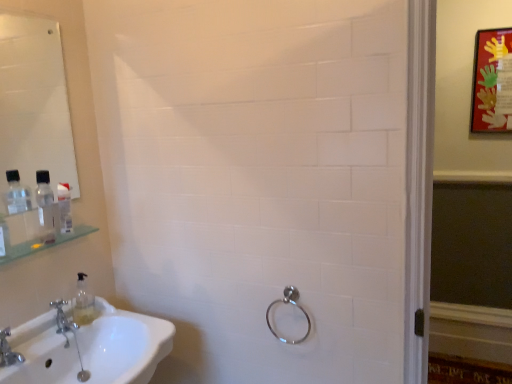
At what (x,y) coordinates should I click in order to perform the action: click on white glossy mirror at upper left. Please return your answer as a coordinate pair (x, y). The width and height of the screenshot is (512, 384). Looking at the image, I should click on (34, 105).

Where is `white glossy sink at lower left`? The height and width of the screenshot is (384, 512). white glossy sink at lower left is located at coordinates (123, 345).

Image resolution: width=512 pixels, height=384 pixels. I want to click on polished chrome towel ring at lower center, so click(292, 304).

Is matte red picture frame at upper right oriented away from clear plastic bottle at left?

matte red picture frame at upper right does not have its back to clear plastic bottle at left.

Considering the positions of objects matte red picture frame at upper right and clear plastic bottle at left in the image provided, who is more to the left, matte red picture frame at upper right or clear plastic bottle at left?

clear plastic bottle at left is more to the left.

Is clear plastic bottle at left a part of matte red picture frame at upper right?

Definitely not — clear plastic bottle at left is not inside matte red picture frame at upper right.

Between matte red picture frame at upper right and clear plastic bottle at left, which one has more height?

matte red picture frame at upper right is taller.

Is polished chrome towel ring at lower center looking in the opposite direction of matte red picture frame at upper right?

No, polished chrome towel ring at lower center's orientation is not away from matte red picture frame at upper right.

Is polished chrome towel ring at lower center located outside matte red picture frame at upper right?

polished chrome towel ring at lower center lies outside matte red picture frame at upper right's area.

From the image's perspective, is polished chrome towel ring at lower center beneath matte red picture frame at upper right?

Yes, from the image's perspective, polished chrome towel ring at lower center is beneath matte red picture frame at upper right.

How much distance is there between polished chrome towel ring at lower center and matte red picture frame at upper right?

The distance of polished chrome towel ring at lower center from matte red picture frame at upper right is 1.56 meters.

Considering the points (487, 58) and (4, 348), which point is behind, point (487, 58) or point (4, 348)?

Point (487, 58)

Looking at this image, between matte red picture frame at upper right and brushed metal faucet at lower left, the 1th tap in the left-to-right sequence, which one is positioned behind?

matte red picture frame at upper right is behind.

How distant is matte red picture frame at upper right from brushed metal faucet at lower left, the first tap when ordered from front to back?

matte red picture frame at upper right is 2.32 meters from brushed metal faucet at lower left, the first tap when ordered from front to back.

Find the location of a particular element. The image size is (512, 384). picture frame on the right of brushed metal faucet at lower left, acting as the 2th tap starting from the back is located at coordinates (492, 82).

Is white glossy sink at lower left not close to silver metallic faucet at lower left, which is counted as the 1th tap, starting from the right?

No, white glossy sink at lower left is not far away from silver metallic faucet at lower left, which is counted as the 1th tap, starting from the right.

Which point is more forward, (100, 340) or (56, 331)?

Positioned in front is point (56, 331).

This screenshot has height=384, width=512. What are the coordinates of `sink below the silver metallic faucet at lower left, positioned as the 2th tap in front-to-back order (from a real-world perspective)` in the screenshot? It's located at (123, 345).

Between white glossy sink at lower left and silver metallic faucet at lower left, positioned as the 2th tap in front-to-back order, which one has more height?

With more height is white glossy sink at lower left.

Can you confirm if white glossy mirror at upper left is bigger than clear glass shelf at left?

Yes, white glossy mirror at upper left is bigger than clear glass shelf at left.

Between white glossy mirror at upper left and clear glass shelf at left, which one is positioned behind?

clear glass shelf at left is behind.

Is white glossy mirror at upper left inside the boundaries of clear glass shelf at left, or outside?

white glossy mirror at upper left exists outside the volume of clear glass shelf at left.

How distant is white glossy mirror at upper left from clear glass shelf at left?

white glossy mirror at upper left is 15.28 inches from clear glass shelf at left.

Who is shorter, clear plastic bottle at left or white glossy mirror at upper left?

Standing shorter between the two is clear plastic bottle at left.

From a real-world perspective, which is physically above, clear plastic bottle at left or white glossy mirror at upper left?

From a 3D spatial view, white glossy mirror at upper left is above.

Looking at this image, is white glossy mirror at upper left located within clear plastic bottle at left?

No, white glossy mirror at upper left is located outside of clear plastic bottle at left.

From a real-world perspective, between clear glass shelf at left and silver metallic faucet at lower left, positioned as the 2th tap in front-to-back order, who is vertically lower?

silver metallic faucet at lower left, positioned as the 2th tap in front-to-back order.

Is clear glass shelf at left looking in the opposite direction of silver metallic faucet at lower left, which is counted as the 1th tap, starting from the right?

clear glass shelf at left is not turned away from silver metallic faucet at lower left, which is counted as the 1th tap, starting from the right.

Locate an element on the screen. This screenshot has height=384, width=512. shelf in front of the silver metallic faucet at lower left, which is counted as the 1th tap, starting from the right is located at coordinates (35, 233).

Considering the sizes of objects clear glass shelf at left and silver metallic faucet at lower left, which is counted as the 1th tap, starting from the right, in the image provided, who is bigger, clear glass shelf at left or silver metallic faucet at lower left, which is counted as the 1th tap, starting from the right,?

With larger size is clear glass shelf at left.

In order to click on mouthwash that appears on the left of matte red picture frame at upper right in this screenshot , I will do `click(45, 207)`.

Find the location of `picture frame on the right of polished chrome towel ring at lower center`. picture frame on the right of polished chrome towel ring at lower center is located at coordinates (492, 82).

When comparing their distances from brushed metal faucet at lower left, acting as the 2th tap starting from the back, does white glossy sink at lower left or silver metallic faucet at lower left, positioned as the 2th tap in front-to-back order, seem closer?

silver metallic faucet at lower left, positioned as the 2th tap in front-to-back order, is closer to brushed metal faucet at lower left, acting as the 2th tap starting from the back.

Considering their positions, is matte red picture frame at upper right positioned further to white glossy sink at lower left than clear plastic bottle at left?

matte red picture frame at upper right is further to white glossy sink at lower left.

In the scene shown: When comparing their distances from clear plastic bottle at left, does silver metallic faucet at lower left, which is the first tap from back to front, or white glossy sink at lower left seem further?

white glossy sink at lower left is further to clear plastic bottle at left.

Considering their positions, is silver metallic faucet at lower left, positioned as the 2th tap in front-to-back order, positioned closer to clear glass shelf at left than brushed metal faucet at lower left, which is the second tap from right to left?

Among the two, silver metallic faucet at lower left, positioned as the 2th tap in front-to-back order, is located nearer to clear glass shelf at left.

Looking at the image, which one is located closer to white glossy mirror at upper left, polished chrome towel ring at lower center or silver metallic faucet at lower left, which is the 2th tap from left to right?

Among the two, silver metallic faucet at lower left, which is the 2th tap from left to right, is located nearer to white glossy mirror at upper left.

From the image, which object appears to be nearer to polished chrome towel ring at lower center, white glossy mirror at upper left or white glossy sink at lower left?

Among the two, white glossy sink at lower left is located nearer to polished chrome towel ring at lower center.

When comparing their distances from brushed metal faucet at lower left, the 1th tap in the left-to-right sequence, does clear plastic bottle at left or clear glass shelf at left seem closer?

Among the two, clear glass shelf at left is located nearer to brushed metal faucet at lower left, the 1th tap in the left-to-right sequence.

From the image, which object appears to be nearer to polished chrome towel ring at lower center, white glossy sink at lower left or clear glass shelf at left?

white glossy sink at lower left.

The height and width of the screenshot is (384, 512). Identify the location of mouthwash that lies between white glossy mirror at upper left and brushed metal faucet at lower left, the first tap when ordered from front to back, from top to bottom. (45, 207).

In order to click on shelf located between brushed metal faucet at lower left, the first tap when ordered from front to back, and polished chrome towel ring at lower center in the left-right direction in this screenshot , I will do `click(35, 233)`.

The image size is (512, 384). In order to click on tap between clear glass shelf at left and brushed metal faucet at lower left, which is the second tap from right to left, in the vertical direction in this screenshot , I will do `click(63, 318)`.

Locate an element on the screen. shelf between white glossy mirror at upper left and silver metallic faucet at lower left, which is counted as the 1th tap, starting from the right, in the up-down direction is located at coordinates click(35, 233).